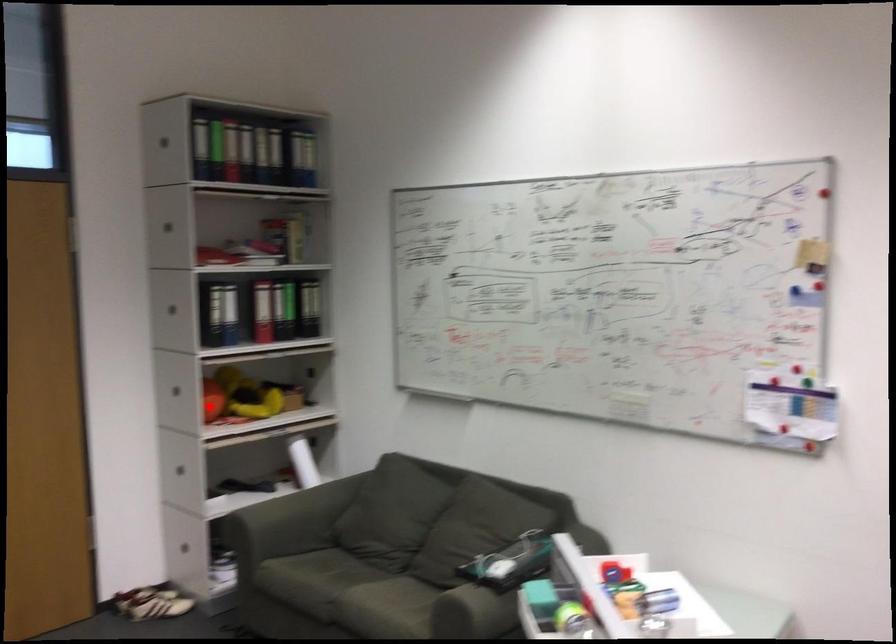
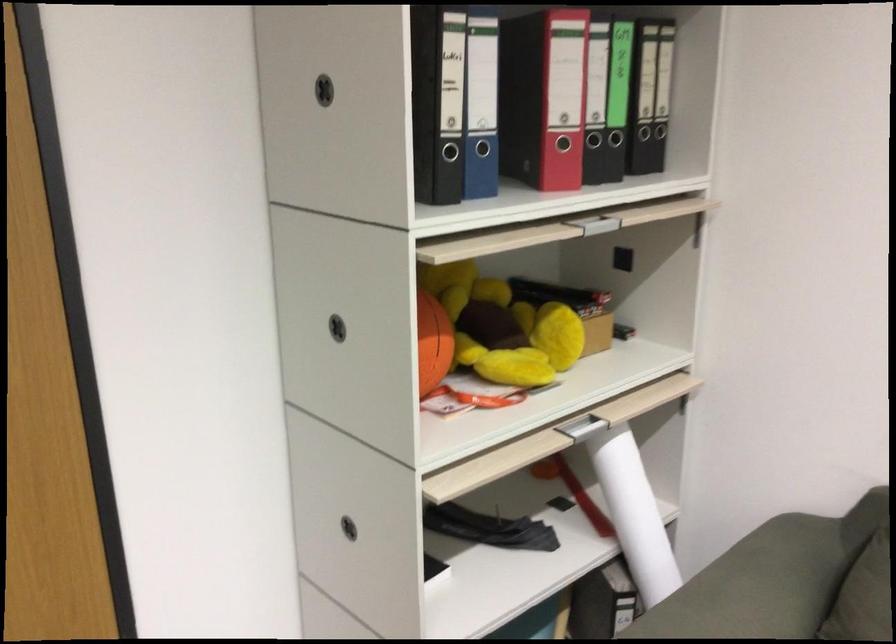
Find the pixel in the second image that matches the highlighted location in the first image.

(433, 343)